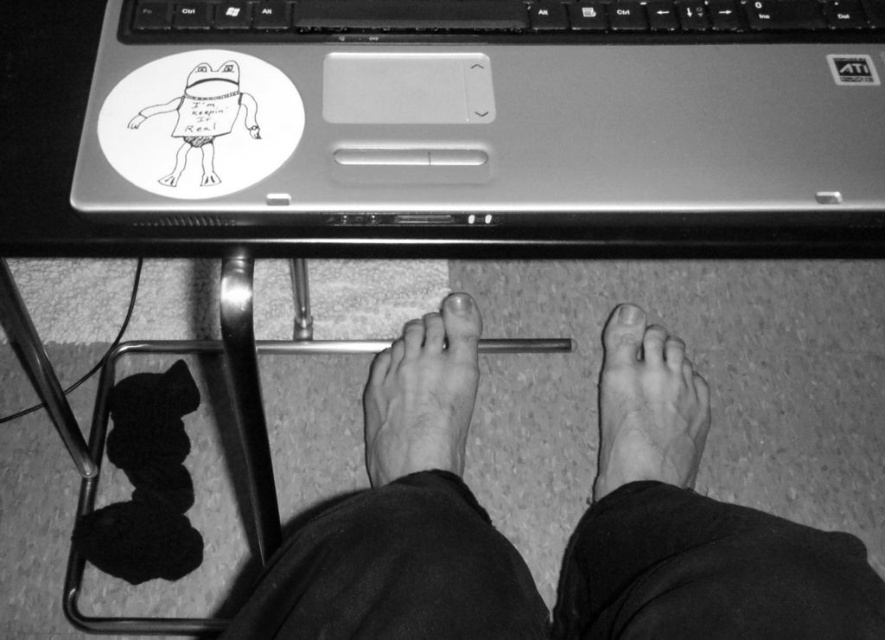
Describe the element at coordinates (514, 19) in the screenshot. I see `black plastic keyboard at upper center` at that location.

Which of these two, black plastic keyboard at upper center or hairless skin foot at lower center, stands taller?

hairless skin foot at lower center is taller.

Who is more forward, (413, 17) or (416, 436)?

Point (413, 17) is in front.

Locate an element on the screen. This screenshot has width=885, height=640. black plastic keyboard at upper center is located at coordinates coord(514,19).

Is black plastic keyboard at upper center shorter than metallic silver sticker at upper right?

No.

Is black plastic keyboard at upper center above metallic silver sticker at upper right?

Yes.

Who is more forward, (548, 20) or (830, 72)?

Point (830, 72) is in front.

You are a GUI agent. You are given a task and a screenshot of the screen. Output one action in this format:
    pyautogui.click(x=<x>, y=<y>)
    Task: Click on the black plastic keyboard at upper center
    The image size is (885, 640).
    Given the screenshot: What is the action you would take?
    pyautogui.click(x=514, y=19)

Which is below, hairless skin foot at lower center or dry skin foot at lower center?

dry skin foot at lower center is below.

Is hairless skin foot at lower center positioned behind dry skin foot at lower center?

No, it is not.

Image resolution: width=885 pixels, height=640 pixels. What are the coordinates of `hairless skin foot at lower center` in the screenshot? It's located at (422, 394).